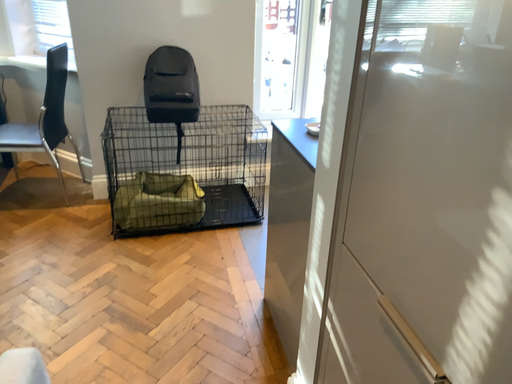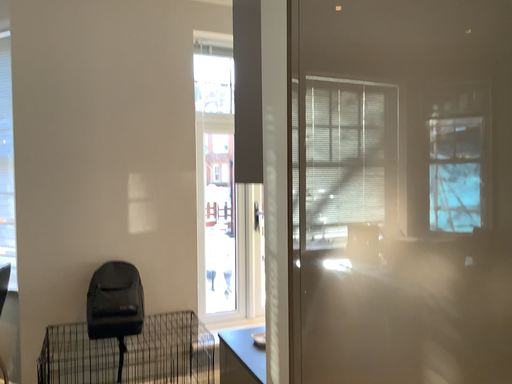
Question: Which way did the camera rotate in the video?

Choices:
 (A) rotated left
 (B) rotated right

Answer: (B)